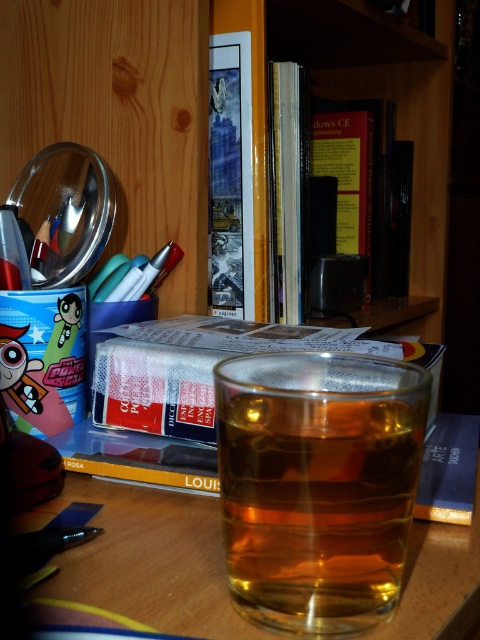
Is translucent glass at center to the left of transparent glass at center from the viewer's perspective?

No, translucent glass at center is not to the left of transparent glass at center.

Is translucent glass at center below transparent glass at center?

Actually, translucent glass at center is above transparent glass at center.

Which is in front, point (389, 380) or point (444, 554)?

Point (389, 380) is more forward.

Locate an element on the screen. This screenshot has height=640, width=480. translucent glass at center is located at coordinates (317, 484).

Is transparent glass at center to the right of hardcover books at center from the viewer's perspective?

No, transparent glass at center is not to the right of hardcover books at center.

Is transparent glass at center above hardcover books at center?

No, transparent glass at center is not above hardcover books at center.

Which is behind, point (428, 588) or point (402, 72)?

Positioned behind is point (402, 72).

Identify the location of transparent glass at center. This screenshot has width=480, height=640. (143, 563).

Which is in front, point (308, 563) or point (216, 6)?

Positioned in front is point (308, 563).

Who is positioned more to the right, translucent glass at center or hardcover books at center?

From the viewer's perspective, hardcover books at center appears more on the right side.

Between point (324, 529) and point (408, 324), which one is positioned behind?

Positioned behind is point (408, 324).

Locate an element on the screen. The height and width of the screenshot is (640, 480). translucent glass at center is located at coordinates (317, 484).